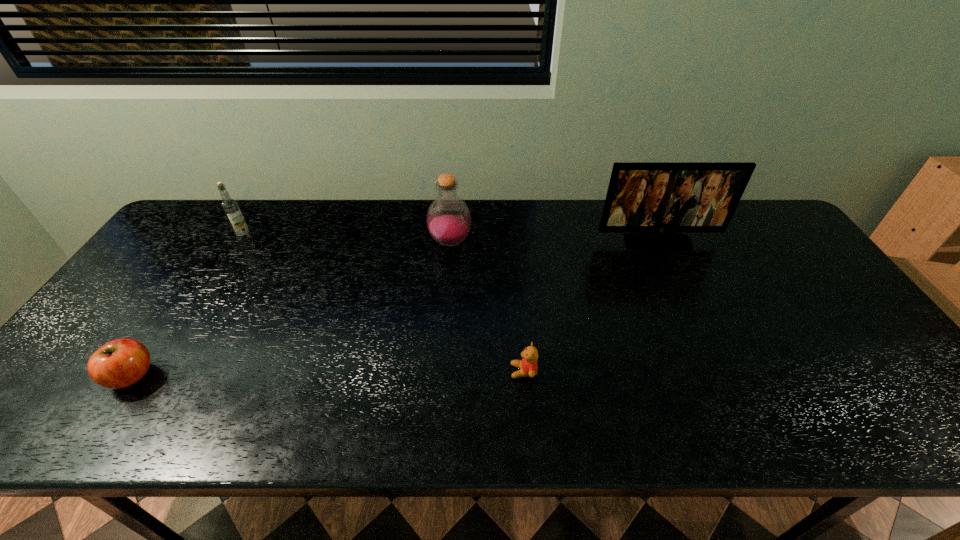
In order to click on vacant space in between the fourth tallest object and the vodka in this screenshot , I will do `click(188, 307)`.

This screenshot has height=540, width=960. Identify the location of free space between the fourth tallest object and the monitor. (395, 309).

Where is `blank region between the vodka and the apple`? blank region between the vodka and the apple is located at coordinates (188, 307).

Select which object appears as the fourth closest to the vodka. Please provide its 2D coordinates. Your answer should be formatted as a tuple, i.e. [(x, y)], where the tuple contains the x and y coordinates of a point satisfying the conditions above.

[(659, 199)]

Find the location of a particular element. object that stands as the fourth closest to the vodka is located at coordinates (659, 199).